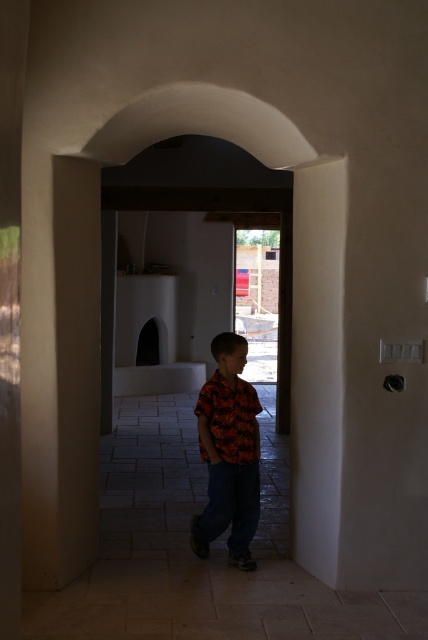
Question: Which object is farther from the camera taking this photo?

Choices:
 (A) orange printed shirt at center
 (B) smooth beige pillar at left

Answer: (A)

Question: In this image, where is smooth beige pillar at left located relative to orange printed shirt at center?

Choices:
 (A) right
 (B) left

Answer: (B)

Question: Is smooth beige pillar at left smaller than orange printed shirt at center?

Choices:
 (A) yes
 (B) no

Answer: (B)

Question: Among these points, which one is nearest to the camera?

Choices:
 (A) (39, 301)
 (B) (199, 545)

Answer: (A)

Question: Does smooth beige pillar at left appear on the left side of orange printed shirt at center?

Choices:
 (A) yes
 (B) no

Answer: (A)